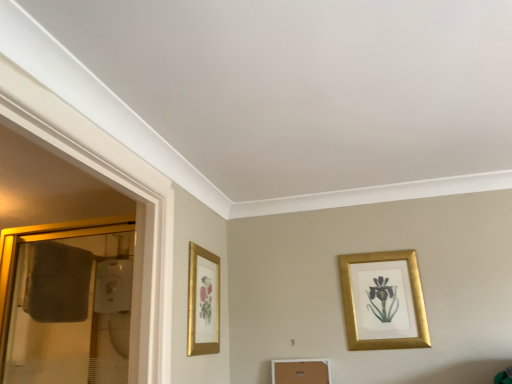
Question: Is gold metallic picture frame at upper right, placed as the 1th picture frame when sorted from right to left, to the right of gold-framed mirror at left from the viewer's perspective?

Choices:
 (A) no
 (B) yes

Answer: (B)

Question: Can you confirm if gold metallic picture frame at upper right, which appears as the 2th picture frame when viewed from the left, is bigger than gold-framed mirror at left?

Choices:
 (A) no
 (B) yes

Answer: (A)

Question: Is gold metallic picture frame at upper right, which appears as the 2th picture frame when viewed from the left, facing away from gold-framed mirror at left?

Choices:
 (A) yes
 (B) no

Answer: (B)

Question: Is gold-framed mirror at left located within gold metallic picture frame at upper right, placed as the 1th picture frame when sorted from right to left?

Choices:
 (A) no
 (B) yes

Answer: (A)

Question: Is gold metallic picture frame at upper right, placed as the 1th picture frame when sorted from right to left, not within gold-framed mirror at left?

Choices:
 (A) yes
 (B) no

Answer: (A)

Question: Choose the correct answer: Is gold framed picture at left, the first picture frame viewed from the left, inside gold-framed mirror at left or outside it?

Choices:
 (A) inside
 (B) outside

Answer: (B)

Question: Considering the positions of point (217, 279) and point (78, 243), is point (217, 279) closer or farther from the camera than point (78, 243)?

Choices:
 (A) farther
 (B) closer

Answer: (B)

Question: In terms of height, does gold framed picture at left, the first picture frame viewed from the left, look taller or shorter compared to gold-framed mirror at left?

Choices:
 (A) tall
 (B) short

Answer: (B)

Question: From the image's perspective, is gold framed picture at left, the first picture frame viewed from the left, located above or below gold-framed mirror at left?

Choices:
 (A) above
 (B) below

Answer: (B)

Question: Considering their positions, is gold metallic picture frame at upper right, which appears as the 2th picture frame when viewed from the left, located in front of or behind gold-framed mirror at left?

Choices:
 (A) behind
 (B) front

Answer: (A)

Question: Do you think gold metallic picture frame at upper right, placed as the 1th picture frame when sorted from right to left, is within gold-framed mirror at left, or outside of it?

Choices:
 (A) outside
 (B) inside

Answer: (A)

Question: Considering the positions of gold metallic picture frame at upper right, which appears as the 2th picture frame when viewed from the left, and gold-framed mirror at left in the image, is gold metallic picture frame at upper right, which appears as the 2th picture frame when viewed from the left, bigger or smaller than gold-framed mirror at left?

Choices:
 (A) big
 (B) small

Answer: (B)

Question: Is point (355, 344) closer or farther from the camera than point (35, 370)?

Choices:
 (A) closer
 (B) farther

Answer: (A)

Question: From the image's perspective, relative to gold framed picture at left, the second picture frame when ordered from right to left, is gold metallic picture frame at upper right, placed as the 1th picture frame when sorted from right to left, above or below?

Choices:
 (A) below
 (B) above

Answer: (A)

Question: Based on their positions, is gold metallic picture frame at upper right, which appears as the 2th picture frame when viewed from the left, located to the left or right of gold framed picture at left, the second picture frame when ordered from right to left?

Choices:
 (A) right
 (B) left

Answer: (A)